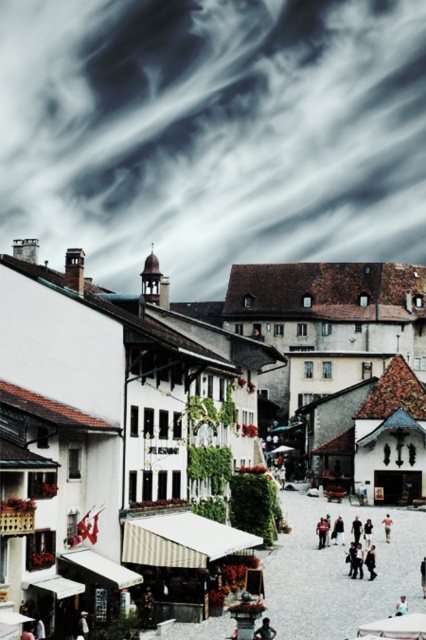
Question: Does dark gray cloud at upper center have a larger size compared to dark blue fabric coat at center?

Choices:
 (A) yes
 (B) no

Answer: (A)

Question: Is light brown leather jacket at center positioned in front of light blue fabric shirt at center?

Choices:
 (A) no
 (B) yes

Answer: (B)

Question: Considering the real-world distances, which object is farthest from the white stone town square at center?

Choices:
 (A) white cotton shirt at center
 (B) dark blue fabric coat at center
 (C) light brown wooden bench at center
 (D) light brown leather jacket at center

Answer: (D)

Question: Which object is positioned farthest from the white stone town square at center?

Choices:
 (A) light brown leather jacket at center
 (B) dark gray cloud at upper center

Answer: (B)

Question: Does dark gray cloud at upper center appear over white stone town square at center?

Choices:
 (A) yes
 (B) no

Answer: (A)

Question: Which point is farther from the camera taking this photo?

Choices:
 (A) (388, 515)
 (B) (397, 609)
 (C) (78, 634)

Answer: (A)